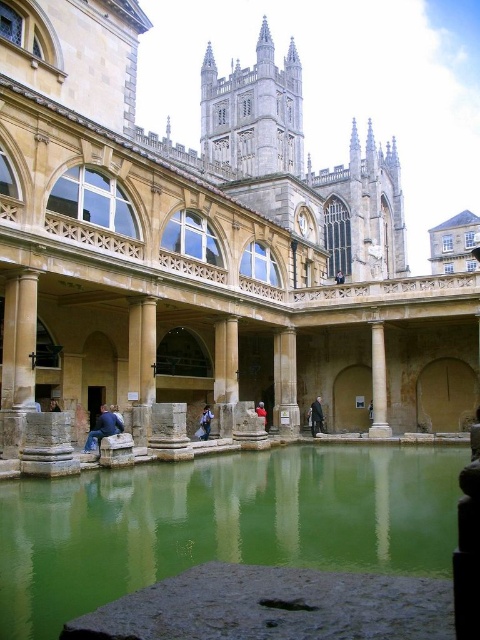
Describe the element at coordinates (103, 428) in the screenshot. This screenshot has width=480, height=640. I see `blue denim jeans at lower left` at that location.

At what (x,y) coordinates should I click in order to perform the action: click on blue denim jeans at lower left. Please return your answer as a coordinate pair (x, y). Image resolution: width=480 pixels, height=640 pixels. Looking at the image, I should click on (103, 428).

Is stone water at center above white marble column at center?

Yes, stone water at center is above white marble column at center.

Which is more to the right, stone water at center or white marble column at center?

white marble column at center

The image size is (480, 640). I want to click on stone water at center, so click(206, 253).

The image size is (480, 640). In order to click on stone water at center in this screenshot , I will do `click(206, 253)`.

Which is behind, point (319, 401) or point (255, 410)?

The point (319, 401) is more distant.

Can you confirm if dark gray suit at center is thinner than red velvet coat at center?

In fact, dark gray suit at center might be wider than red velvet coat at center.

Who is more forward, [322,412] or [265,420]?

Point [265,420] is more forward.

Find the location of a particular element. dark gray suit at center is located at coordinates (316, 417).